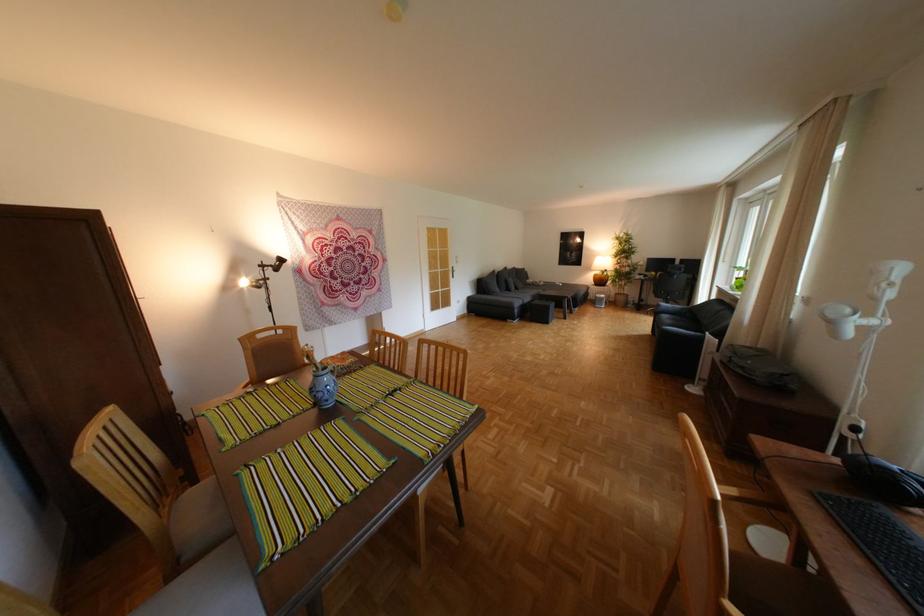
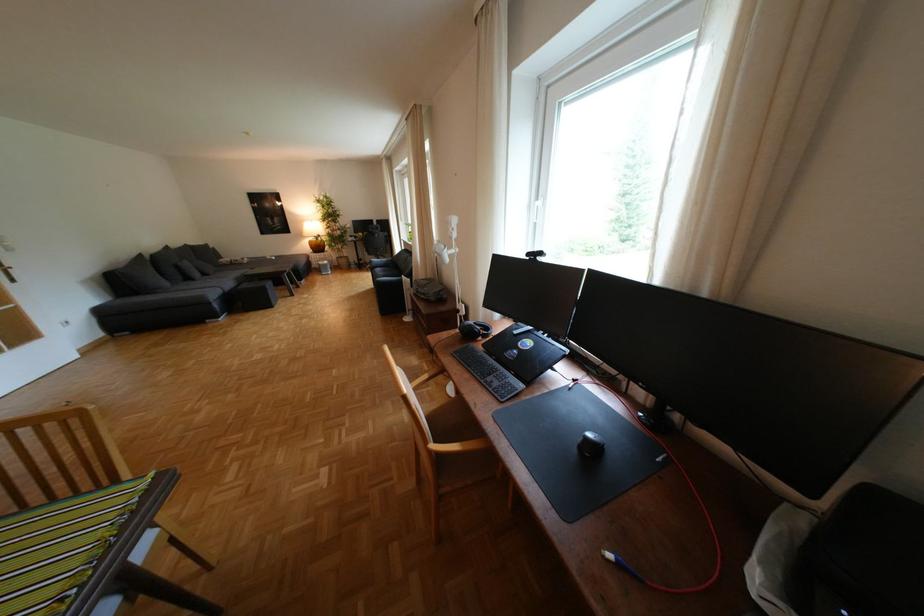
Question: How did the camera likely rotate?

Choices:
 (A) Left
 (B) Right
 (C) Up
 (D) Down

Answer: (B)